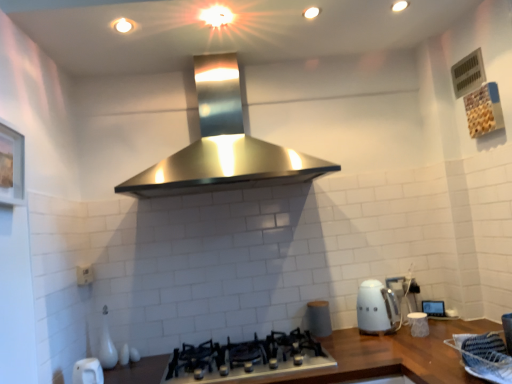
What is the approximate width of matte gray canister at center?

matte gray canister at center is 4.08 inches wide.

At what (x,y) coordinates should I click in order to perform the action: click on white plastic electric outlet at lower left. Please return your answer as a coordinate pair (x, y). The height and width of the screenshot is (384, 512). Looking at the image, I should click on (84, 275).

Find the location of a particular element. The image size is (512, 384). satin black gas stove at center is located at coordinates tap(254, 358).

Find the location of `white glossy kettle at lower right`. white glossy kettle at lower right is located at coordinates (377, 309).

Are white glossy kettle at lower right and satin black gas stove at center making contact?

No, white glossy kettle at lower right is not in contact with satin black gas stove at center.

Could you tell me if white glossy kettle at lower right is facing satin black gas stove at center?

No, white glossy kettle at lower right is not facing towards satin black gas stove at center.

I want to click on gas stove located below the white glossy kettle at lower right (from the image's perspective), so click(254, 358).

How much distance is there between white glossy kettle at lower right and satin black gas stove at center?

They are 18.83 inches apart.

Considering the relative sizes of satin black gas stove at center and white plastic electric outlet at lower left in the image provided, is satin black gas stove at center smaller than white plastic electric outlet at lower left?

No.

Can you tell me how much satin black gas stove at center and white plastic electric outlet at lower left differ in facing direction?

The facing directions of satin black gas stove at center and white plastic electric outlet at lower left are 89.3 degrees apart.

Is point (247, 359) in front of point (82, 275)?

Yes, it is in front of point (82, 275).

Is satin black gas stove at center far from white plastic electric outlet at lower left?

No, satin black gas stove at center is in close proximity to white plastic electric outlet at lower left.

Is satin black gas stove at center positioned behind matte gray canister at center?

No, the depth of satin black gas stove at center is less than that of matte gray canister at center.

Is satin black gas stove at center bigger or smaller than matte gray canister at center?

In the image, satin black gas stove at center appears to be larger than matte gray canister at center.

The image size is (512, 384). I want to click on appliance lying behind the satin black gas stove at center, so [x=319, y=318].

Which is more to the right, satin black gas stove at center or matte gray canister at center?

matte gray canister at center.

From the image's perspective, which object appears higher, white plastic electric outlet at lower left or satin black gas stove at center?

From the image's view, white plastic electric outlet at lower left is above.

Is white plastic electric outlet at lower left positioned beyond the bounds of satin black gas stove at center?

white plastic electric outlet at lower left lies outside satin black gas stove at center's area.

Which point is more forward, (88, 265) or (310, 350)?

The point (310, 350) is closer to the camera.

In terms of height, does white plastic electric outlet at lower left look taller or shorter compared to satin black gas stove at center?

In the image, white plastic electric outlet at lower left appears to be taller than satin black gas stove at center.

Based on the photo, between white plastic electric outlet at lower left and white glossy kettle at lower right, which one has larger width?

Wider between the two is white glossy kettle at lower right.

Locate an element on the screen. The width and height of the screenshot is (512, 384). kitchen appliance below the white plastic electric outlet at lower left (from the image's perspective) is located at coordinates (377, 309).

Considering the positions of objects white plastic electric outlet at lower left and white glossy kettle at lower right in the image provided, who is more to the left, white plastic electric outlet at lower left or white glossy kettle at lower right?

Positioned to the left is white plastic electric outlet at lower left.

From the image's perspective, is white plastic electric outlet at lower left on white glossy kettle at lower right?

Yes, from the image's perspective, white plastic electric outlet at lower left is over white glossy kettle at lower right.

Is point (382, 328) more distant than point (326, 335)?

No.

Is white glossy kettle at lower right at the right side of matte gray canister at center?

Correct, you'll find white glossy kettle at lower right to the right of matte gray canister at center.

Which of these two, white glossy kettle at lower right or matte gray canister at center, stands taller?

With more height is white glossy kettle at lower right.

At what (x,y) coordinates should I click in order to perform the action: click on kitchen appliance in front of the matte gray canister at center. Please return your answer as a coordinate pair (x, y). Looking at the image, I should click on (377, 309).

Which point is more distant from viewer, (322,336) or (381,308)?

The point (322,336) is farther.

Between matte gray canister at center and white glossy kettle at lower right, which one has more height?

white glossy kettle at lower right is taller.

From the image's perspective, is matte gray canister at center above white glossy kettle at lower right?

No, from the image's perspective, matte gray canister at center is not over white glossy kettle at lower right.

In the scene shown: How many degrees apart are the facing directions of matte gray canister at center and white glossy kettle at lower right?

The angular difference between matte gray canister at center and white glossy kettle at lower right is 0.548 degrees.

In the image, there is a white glossy kettle at lower right. Where is `gas stove below it (from a real-world perspective)`? The width and height of the screenshot is (512, 384). gas stove below it (from a real-world perspective) is located at coordinates (254, 358).

Locate an element on the screen. This screenshot has height=384, width=512. electric outlet that appears behind the satin black gas stove at center is located at coordinates (84, 275).

Which object lies nearer to the anchor point matte gray canister at center, white plastic electric outlet at lower left or satin black gas stove at center?

Among the two, satin black gas stove at center is located nearer to matte gray canister at center.

Which object lies further to the anchor point white glossy kettle at lower right, satin black gas stove at center or matte gray canister at center?

Among the two, satin black gas stove at center is located further to white glossy kettle at lower right.

Which object lies further to the anchor point white glossy kettle at lower right, white plastic electric outlet at lower left or satin black gas stove at center?

The object further to white glossy kettle at lower right is white plastic electric outlet at lower left.

Based on the photo, based on their spatial positions, is white plastic electric outlet at lower left or white glossy kettle at lower right closer to matte gray canister at center?

The object closer to matte gray canister at center is white glossy kettle at lower right.

From the image, which object appears to be nearer to white glossy kettle at lower right, matte gray canister at center or satin black gas stove at center?

Among the two, matte gray canister at center is located nearer to white glossy kettle at lower right.

From the image, which object appears to be farther from white glossy kettle at lower right, matte gray canister at center or white plastic electric outlet at lower left?

The object further to white glossy kettle at lower right is white plastic electric outlet at lower left.

From the image, which object appears to be farther from satin black gas stove at center, white glossy kettle at lower right or matte gray canister at center?

The object further to satin black gas stove at center is white glossy kettle at lower right.

Based on their spatial positions, is matte gray canister at center or satin black gas stove at center closer to white plastic electric outlet at lower left?

satin black gas stove at center lies closer to white plastic electric outlet at lower left than the other object.

You are a GUI agent. You are given a task and a screenshot of the screen. Output one action in this format:
    pyautogui.click(x=<x>, y=<y>)
    Task: Click on the appliance between satin black gas stove at center and white glossy kettle at lower right
    
    Given the screenshot: What is the action you would take?
    pyautogui.click(x=319, y=318)

This screenshot has height=384, width=512. I want to click on gas stove between white plastic electric outlet at lower left and white glossy kettle at lower right in the horizontal direction, so click(x=254, y=358).

This screenshot has width=512, height=384. I want to click on appliance between white plastic electric outlet at lower left and white glossy kettle at lower right in the horizontal direction, so click(319, 318).

You are a GUI agent. You are given a task and a screenshot of the screen. Output one action in this format:
    pyautogui.click(x=<x>, y=<y>)
    Task: Click on the gas stove between white plastic electric outlet at lower left and matte gray canister at center
    This screenshot has height=384, width=512.
    Given the screenshot: What is the action you would take?
    pyautogui.click(x=254, y=358)